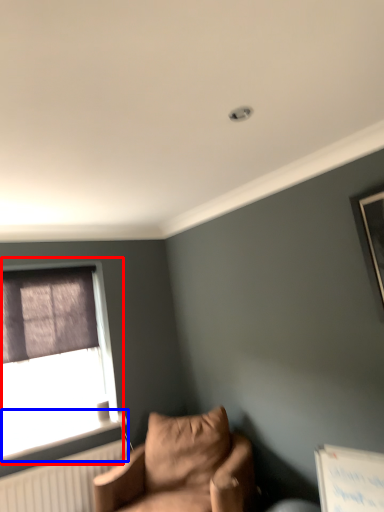
Question: Among these objects, which one is nearest to the camera, window (highlighted by a red box) or window sill (highlighted by a blue box)?

Choices:
 (A) window
 (B) window sill

Answer: (B)